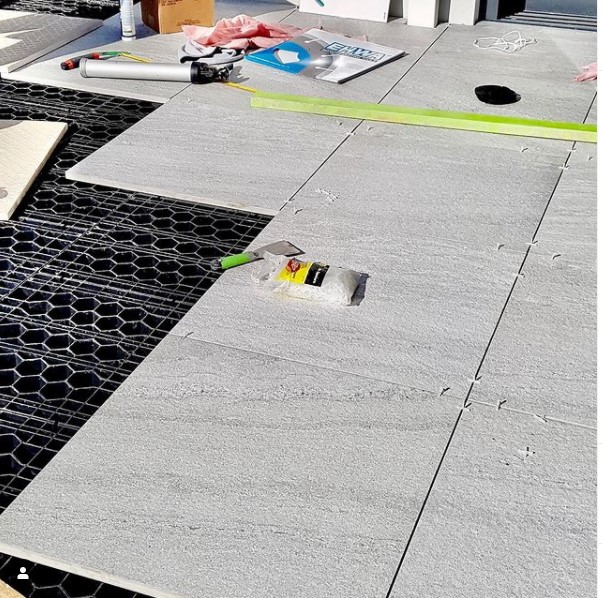
Where is `handle`? handle is located at coordinates (235, 256).